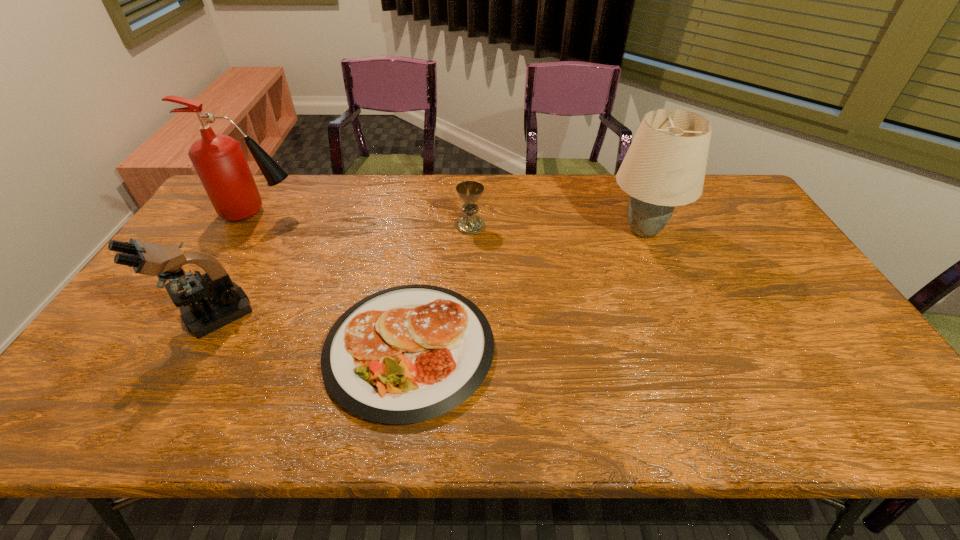
At what (x,y) coordinates should I click in order to perform the action: click on free region that satisfies the following two spatial constraints: 1. with the nozzle aimed from the fire extinguisher; 2. on the right side of the lampshade. Please return your answer as a coordinate pair (x, y). Looking at the image, I should click on (249, 231).

Image resolution: width=960 pixels, height=540 pixels. Find the location of `free location that satisfies the following two spatial constraints: 1. with the nozzle aimed from the lampshade; 2. on the right side of the fire extinguisher`. free location that satisfies the following two spatial constraints: 1. with the nozzle aimed from the lampshade; 2. on the right side of the fire extinguisher is located at coordinates (249, 231).

Find the location of a particular element. Image resolution: width=960 pixels, height=540 pixels. blank space that satisfies the following two spatial constraints: 1. with the nozzle aimed from the chalice; 2. on the left side of the fire extinguisher is located at coordinates (252, 226).

Find the location of a particular element. vacant space that satisfies the following two spatial constraints: 1. with the nozzle aimed from the fire extinguisher; 2. on the back side of the rightmost object is located at coordinates (249, 231).

Find the location of a particular element. The height and width of the screenshot is (540, 960). free space that satisfies the following two spatial constraints: 1. with the nozzle aimed from the fire extinguisher; 2. on the right side of the shortest object is located at coordinates (177, 349).